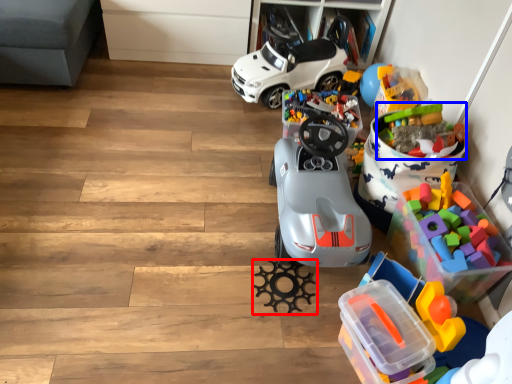
Question: Which of the following is the closest to the observer, toy (highlighted by a red box) or toy (highlighted by a blue box)?

Choices:
 (A) toy
 (B) toy

Answer: (A)